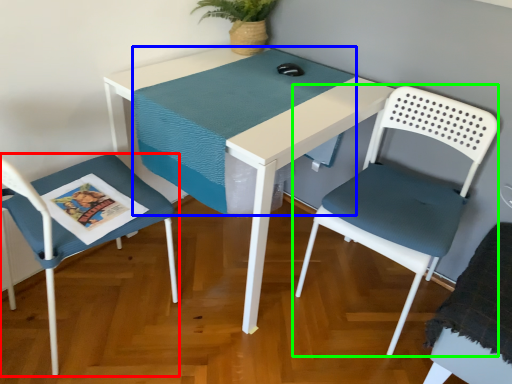
Question: Estimate the real-world distances between objects in this image. Which object is farther from chair (highlighted by a red box), table top (highlighted by a blue box) or chair (highlighted by a green box)?

Choices:
 (A) table top
 (B) chair

Answer: (B)